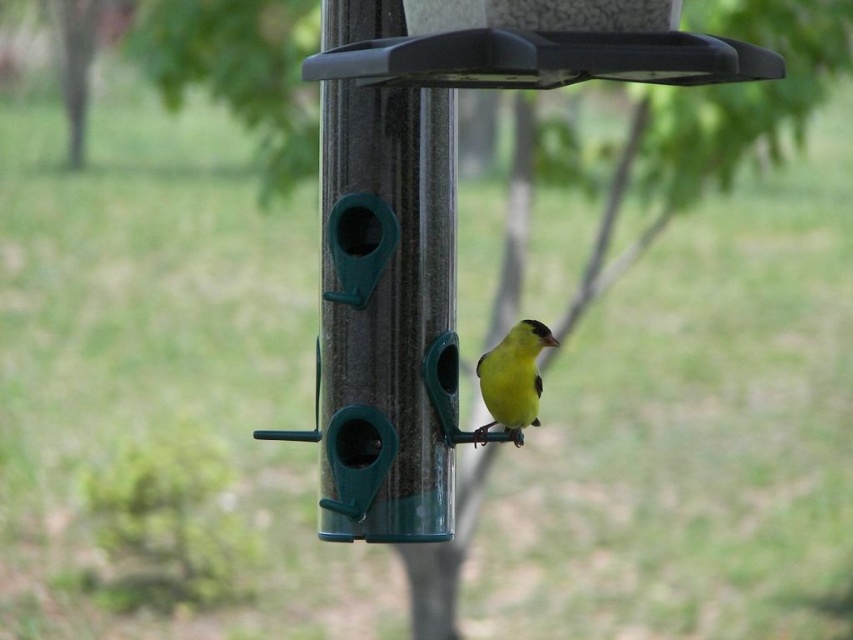
Question: In this image, where is transparent plastic pole at center located relative to yellow matte bird at center?

Choices:
 (A) left
 (B) right

Answer: (A)

Question: Among these objects, which one is nearest to the camera?

Choices:
 (A) yellow matte bird at center
 (B) transparent plastic pole at center

Answer: (B)

Question: Among these points, which one is nearest to the camera?

Choices:
 (A) (392, 452)
 (B) (534, 323)

Answer: (A)

Question: Does transparent plastic pole at center appear on the right side of yellow matte bird at center?

Choices:
 (A) no
 (B) yes

Answer: (A)

Question: Can you confirm if transparent plastic pole at center is wider than yellow matte bird at center?

Choices:
 (A) yes
 (B) no

Answer: (A)